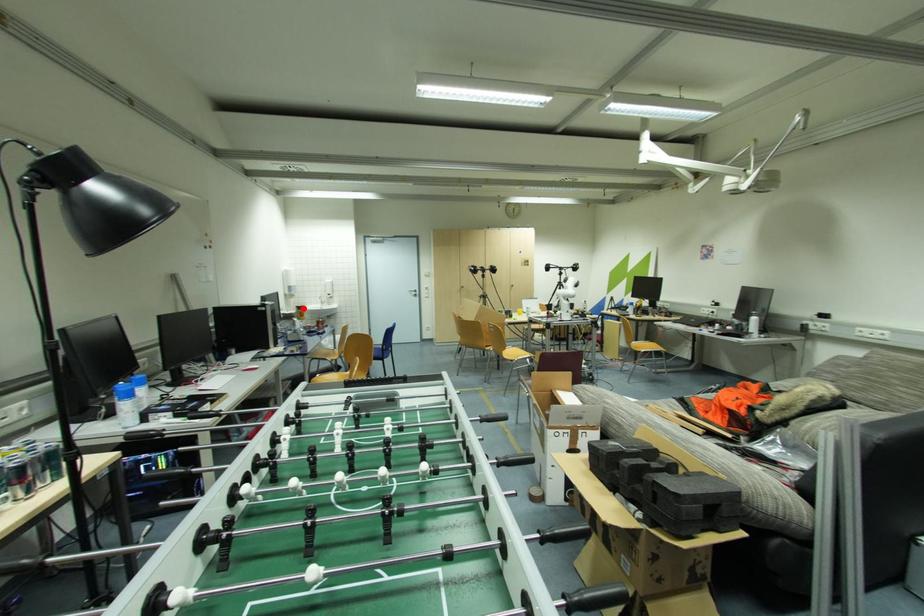
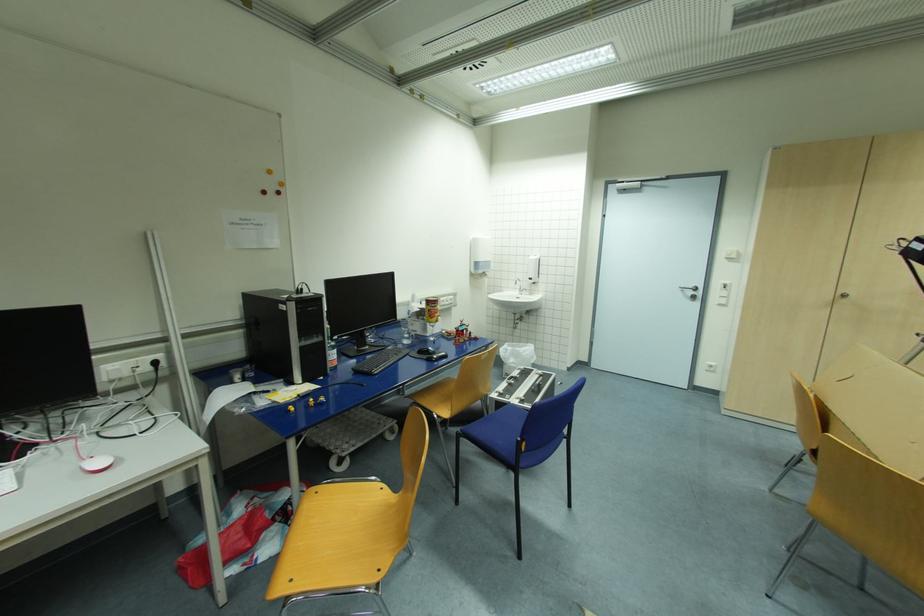
The point at the highlighted location is marked in the first image. Where is the corresponding point in the second image?

(433, 302)